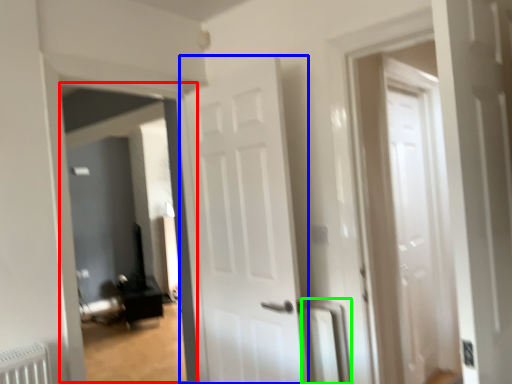
Question: Based on their relative distances, which object is farther from corridor (highlighted by a red box)? Choose from door (highlighted by a blue box) and radiator (highlighted by a green box).

Choices:
 (A) door
 (B) radiator

Answer: (B)